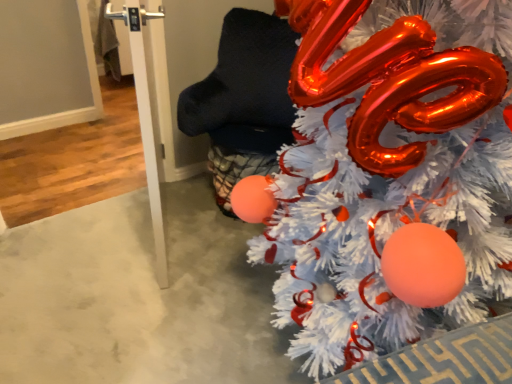
At what (x,y) coordinates should I click in order to perform the action: click on vacant point to the right of white glossy door handle at left. Please return your answer as a coordinate pair (x, y). This screenshot has width=512, height=384. Looking at the image, I should click on (207, 246).